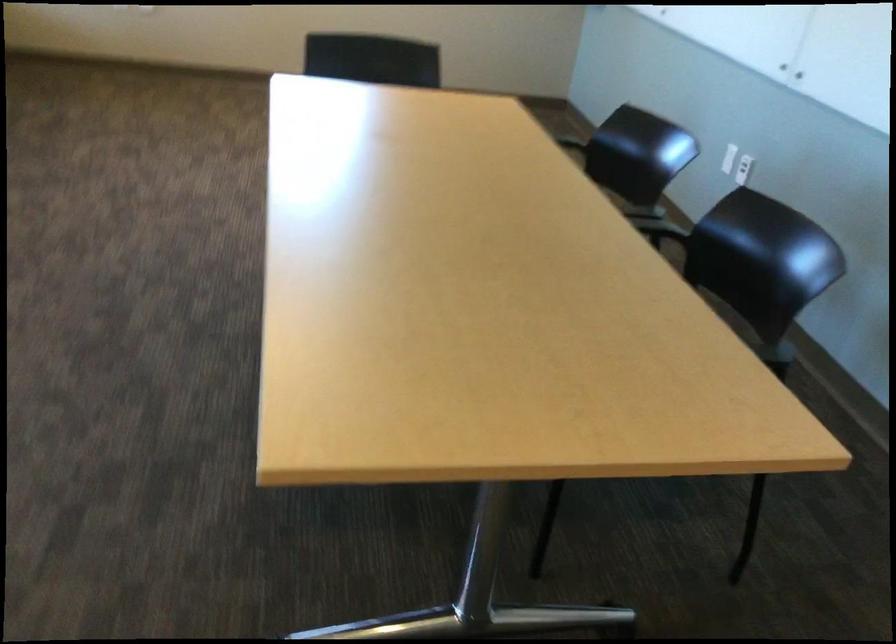
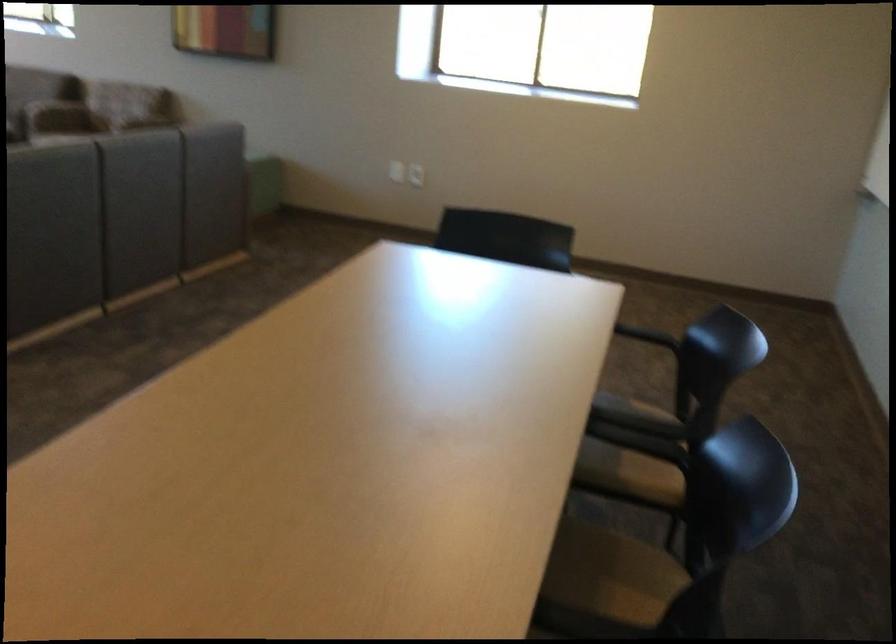
Question: The images are taken continuously from a first-person perspective. In which direction is your viewpoint rotating?

Choices:
 (A) Left
 (B) Right
 (C) Up
 (D) Down

Answer: (A)